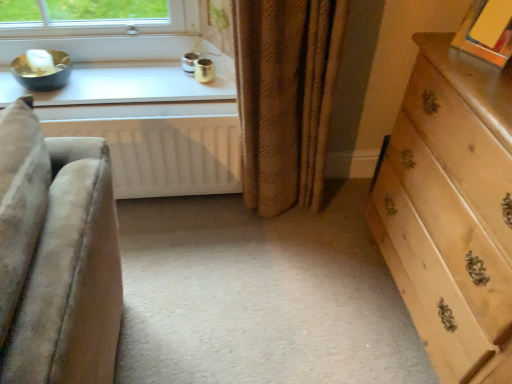
Locate an element on the screen. This screenshot has height=384, width=512. blank space above white matte radiator at lower center (from a real-world perspective) is located at coordinates (120, 107).